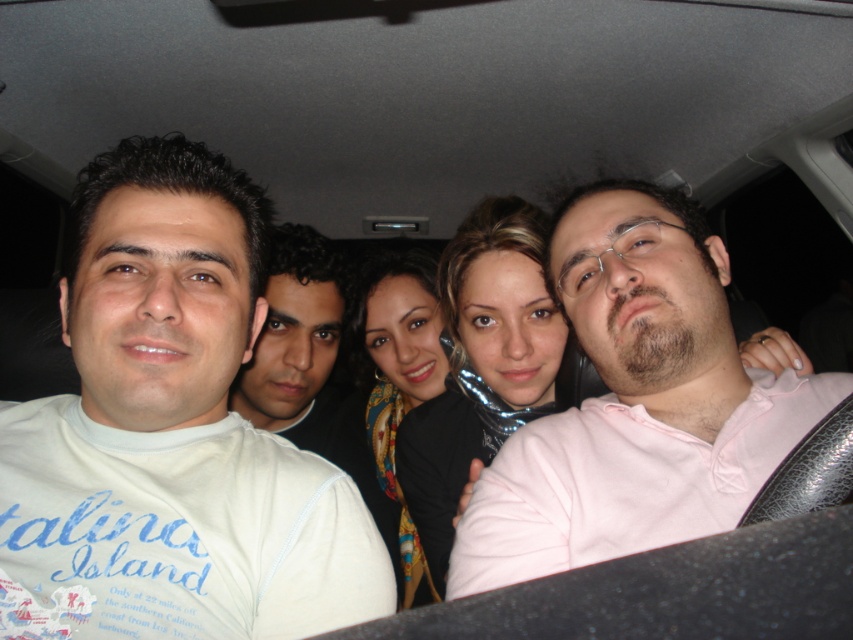
Question: Estimate the real-world distances between objects in this image. Which object is closer to the pink cotton shirt at center?

Choices:
 (A) white cotton shirt at center
 (B) white cotton shirt at left

Answer: (B)

Question: Observing the image, what is the correct spatial positioning of white cotton shirt at left in reference to white cotton shirt at center?

Choices:
 (A) left
 (B) right

Answer: (B)

Question: Which object is farther from the camera taking this photo?

Choices:
 (A) white cotton shirt at left
 (B) pink cotton shirt at center

Answer: (B)

Question: Can you confirm if white cotton shirt at left is smaller than white cotton shirt at center?

Choices:
 (A) no
 (B) yes

Answer: (B)

Question: Is pink cotton shirt at center positioned before white cotton shirt at center?

Choices:
 (A) no
 (B) yes

Answer: (B)

Question: Which point is farther from the camera taking this photo?

Choices:
 (A) (520, 513)
 (B) (144, 360)
 (C) (355, 417)

Answer: (C)